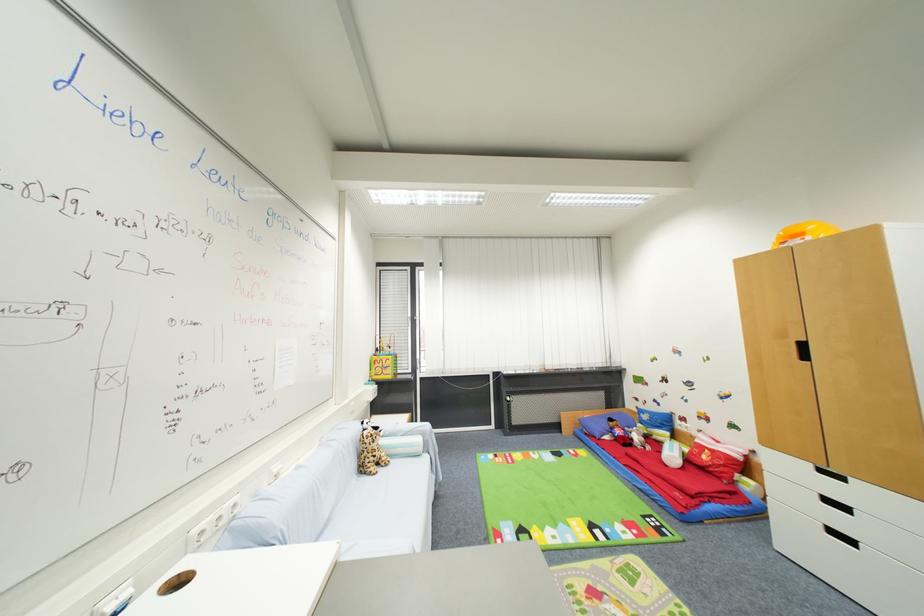
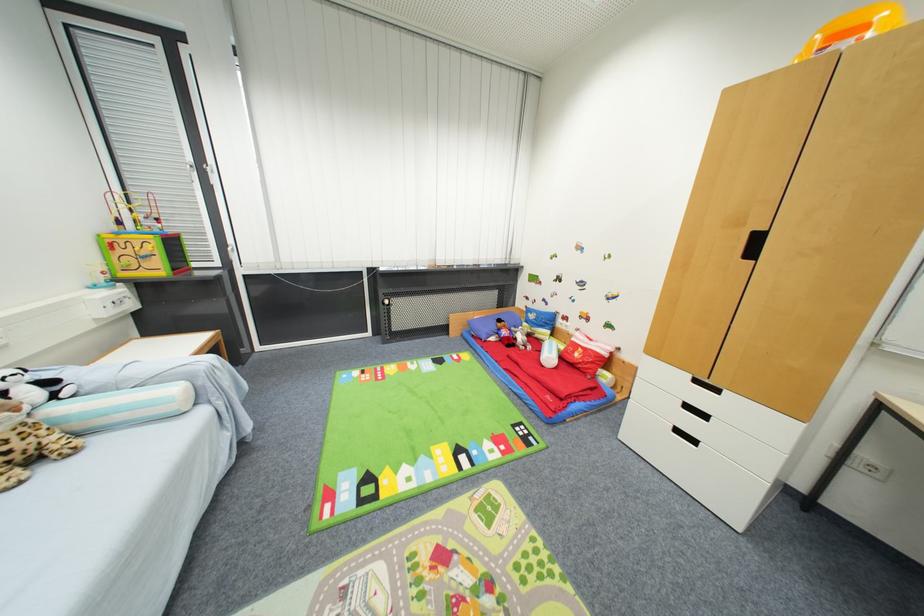
The point at (810, 359) is marked in the first image. Where is the corresponding point in the second image?

(757, 254)